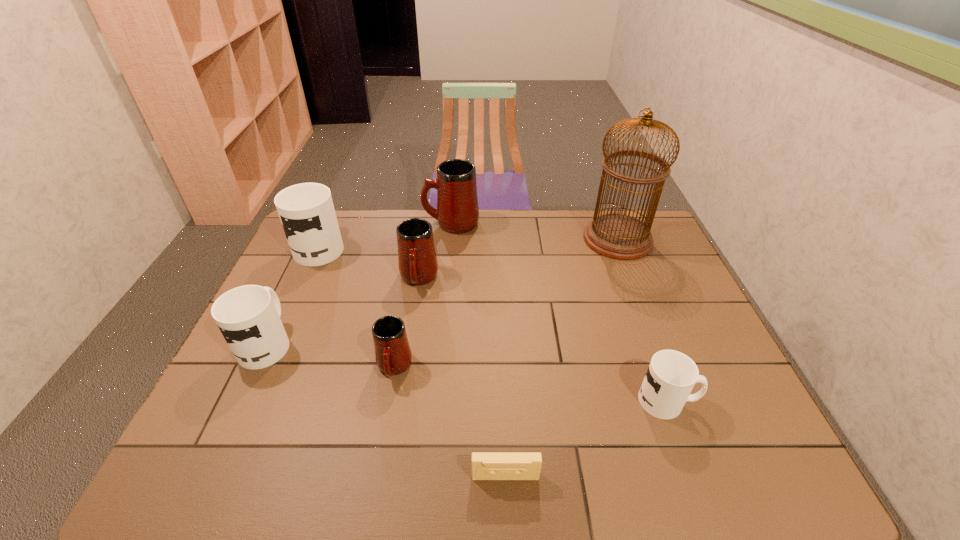
Locate an element on the screen. birdcage is located at coordinates (617, 236).

Where is `the farthest red mug`? the farthest red mug is located at coordinates (457, 212).

Identify the location of the biggest white mug. The image size is (960, 540). (306, 210).

In order to click on the second farthest red mug in this screenshot , I will do `click(417, 261)`.

Locate an element on the screen. This screenshot has height=540, width=960. the second nearest white mug is located at coordinates (248, 316).

Image resolution: width=960 pixels, height=540 pixels. In order to click on the nearest red mug in this screenshot , I will do `click(393, 355)`.

This screenshot has width=960, height=540. I want to click on the nearest white mug, so click(x=671, y=375).

Locate an element on the screen. Image resolution: width=960 pixels, height=540 pixels. the rightmost white mug is located at coordinates (671, 375).

Locate an element on the screen. This screenshot has height=540, width=960. the shortest object is located at coordinates (485, 465).

I want to click on videotape, so click(x=485, y=465).